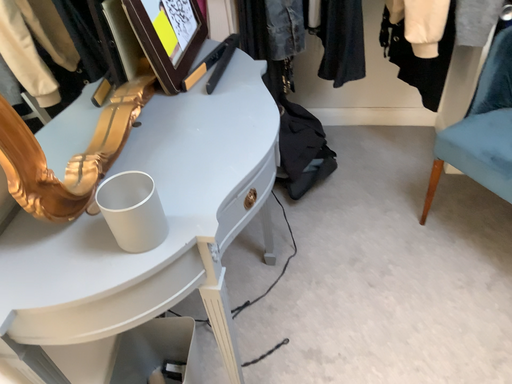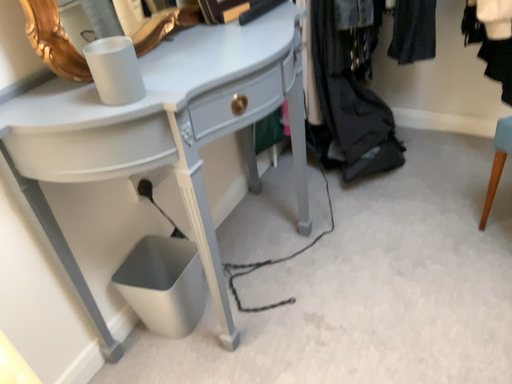
Question: How did the camera likely rotate when shooting the video?

Choices:
 (A) rotated right
 (B) rotated left

Answer: (B)